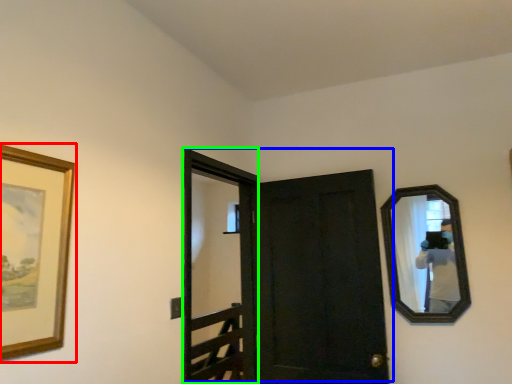
Question: Which is nearer to the picture frame (highlighted by a red box)? door (highlighted by a blue box) or screen door (highlighted by a green box).

Choices:
 (A) door
 (B) screen door

Answer: (A)